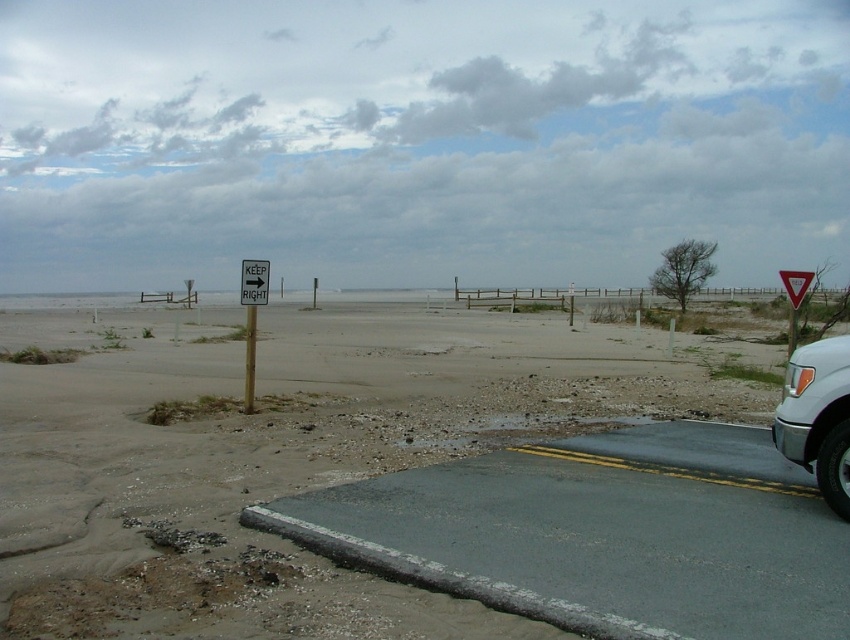
Does white matte truck at right have a lesser height compared to white plastic sign at center?

In fact, white matte truck at right may be taller than white plastic sign at center.

Is white matte truck at right below white plastic sign at center?

Correct, white matte truck at right is located below white plastic sign at center.

Describe the element at coordinates (819, 417) in the screenshot. The image size is (850, 640). I see `white matte truck at right` at that location.

You are a GUI agent. You are given a task and a screenshot of the screen. Output one action in this format:
    pyautogui.click(x=<x>, y=<y>)
    Task: Click on the white matte truck at right
    
    Given the screenshot: What is the action you would take?
    pyautogui.click(x=819, y=417)

Does sandy beach at lower left appear on the left side of white plastic sign at center?

In fact, sandy beach at lower left is to the right of white plastic sign at center.

The image size is (850, 640). What do you see at coordinates (398, 484) in the screenshot?
I see `sandy beach at lower left` at bounding box center [398, 484].

Does point (620, 556) come closer to viewer compared to point (248, 337)?

Yes.

Where is `sandy beach at lower left`? This screenshot has width=850, height=640. sandy beach at lower left is located at coordinates (398, 484).

The height and width of the screenshot is (640, 850). What are the coordinates of `sandy beach at lower left` in the screenshot? It's located at (398, 484).

Is sandy beach at lower left taller than white matte truck at right?

Correct, sandy beach at lower left is much taller as white matte truck at right.

The image size is (850, 640). What are the coordinates of `sandy beach at lower left` in the screenshot? It's located at (398, 484).

Locate an element on the screen. This screenshot has width=850, height=640. sandy beach at lower left is located at coordinates (398, 484).